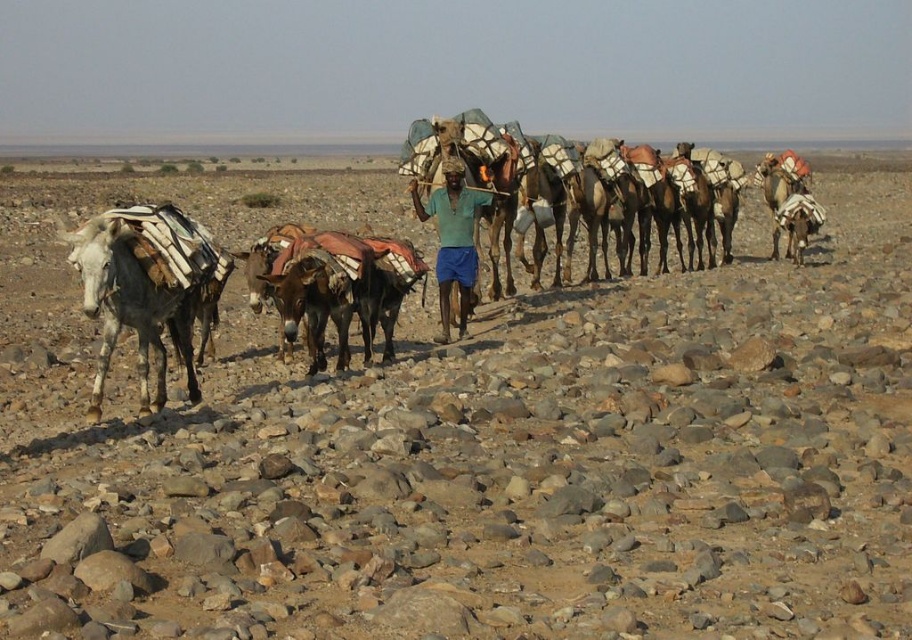
Question: Estimate the real-world distances between objects in this image. Which object is closer to the green fabric shirt at center?

Choices:
 (A) white textured blanket at right
 (B) speckled gray mule at left

Answer: (B)

Question: Does green fabric shirt at center have a smaller size compared to white textured blanket at right?

Choices:
 (A) no
 (B) yes

Answer: (A)

Question: Which point is closer to the camera?

Choices:
 (A) white textured blanket at right
 (B) green fabric shirt at center
 (C) speckled gray mule at left

Answer: (C)

Question: Does green fabric shirt at center appear on the right side of white textured blanket at right?

Choices:
 (A) no
 (B) yes

Answer: (A)

Question: Which object is farther from the camera taking this photo?

Choices:
 (A) speckled gray mule at left
 (B) green fabric shirt at center

Answer: (B)

Question: Considering the relative positions of green fabric shirt at center and white textured blanket at right in the image provided, where is green fabric shirt at center located with respect to white textured blanket at right?

Choices:
 (A) right
 (B) left

Answer: (B)